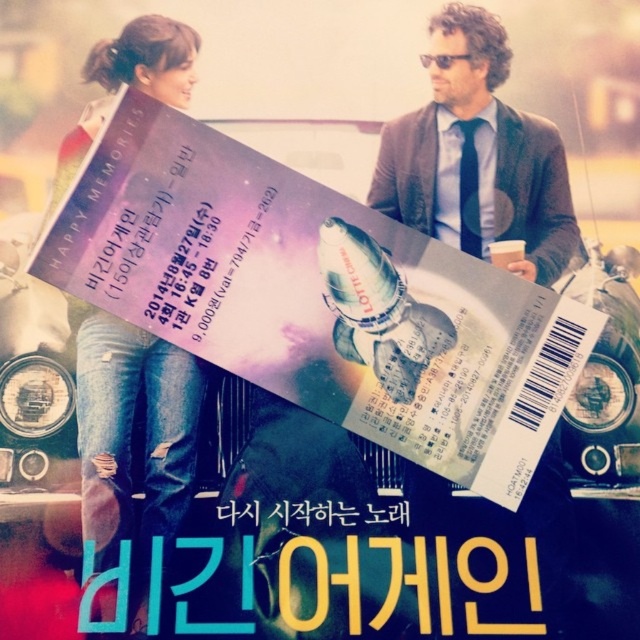
Does jeans at left appear over dark gray sweater at upper right?

Incorrect, jeans at left is not positioned above dark gray sweater at upper right.

Looking at this image, can you confirm if jeans at left is positioned below dark gray sweater at upper right?

Yes.

The image size is (640, 640). What do you see at coordinates (132, 436) in the screenshot? I see `jeans at left` at bounding box center [132, 436].

At what (x,y) coordinates should I click in order to perform the action: click on jeans at left. Please return your answer as a coordinate pair (x, y). This screenshot has height=640, width=640. Looking at the image, I should click on tap(132, 436).